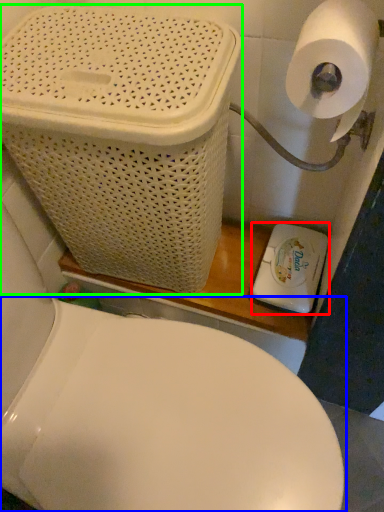
Question: Estimate the real-world distances between objects in this image. Which object is farther from appliance (highlighted by a red box), toilet (highlighted by a blue box) or basket container (highlighted by a green box)?

Choices:
 (A) toilet
 (B) basket container

Answer: (B)